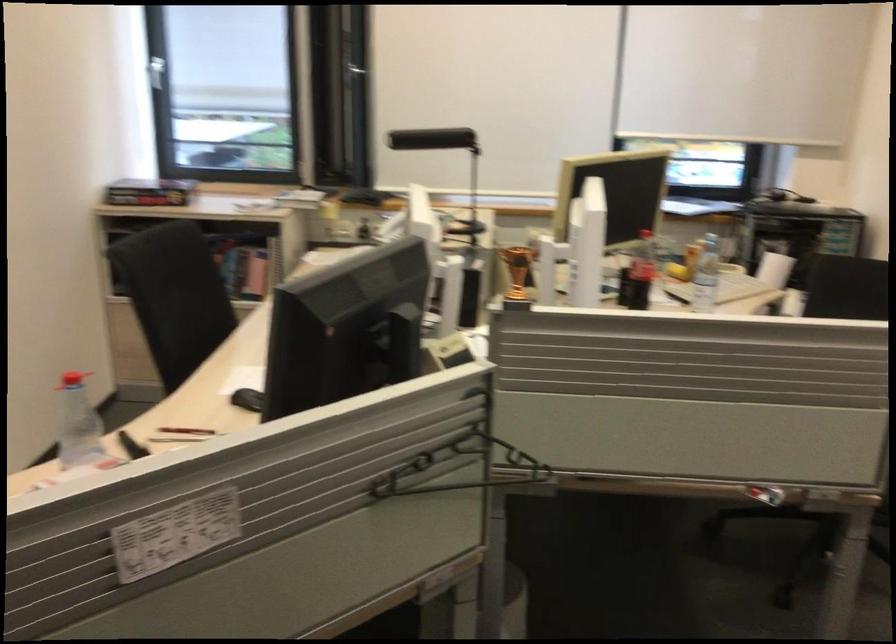
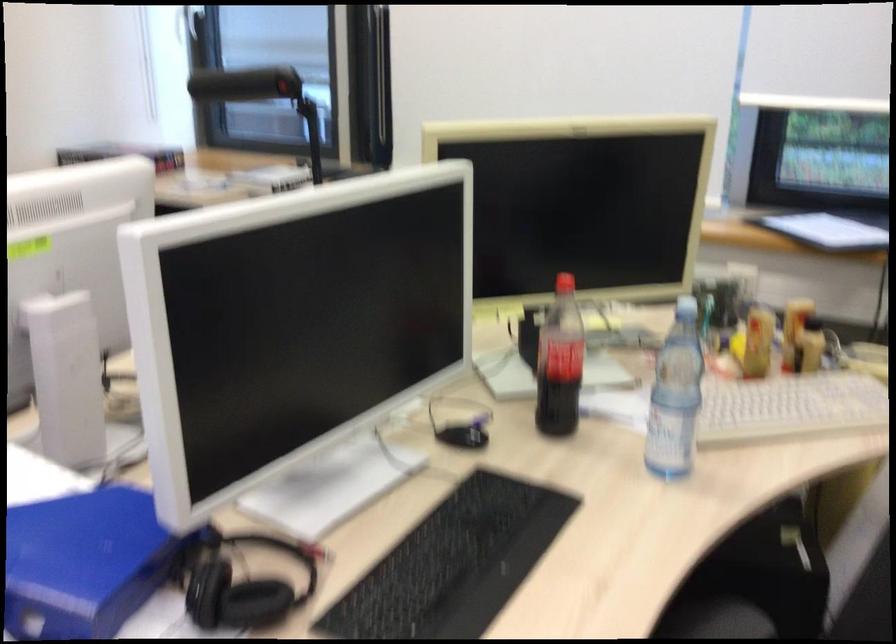
The images are taken continuously from a first-person perspective. In which direction are you moving?

The cameraman moved toward right, forward.